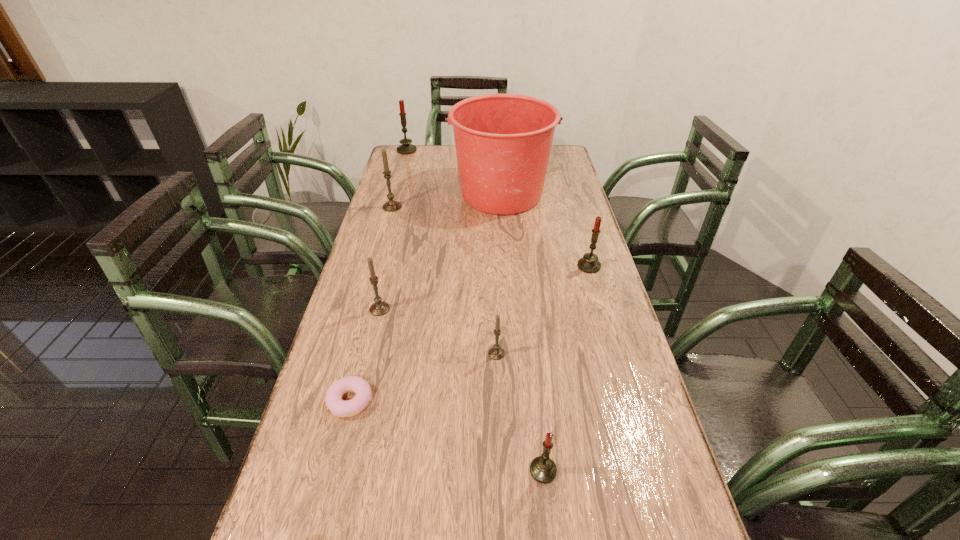
I want to click on object present at the far right corner, so click(x=503, y=142).

Where is `free space at the left edge`? free space at the left edge is located at coordinates (307, 529).

In the image, there is a desktop. In order to click on free space at the right edge in this screenshot , I will do `click(598, 326)`.

At what (x,y) coordinates should I click in order to perform the action: click on free area in between the pink bucket and the third nearest object. Please return your answer as a coordinate pair (x, y). This screenshot has height=540, width=960. Looking at the image, I should click on (499, 274).

Find the location of a particular element. The image size is (960, 540). vacant space that's between the second biggest gray candle and the smallest gray candle is located at coordinates (438, 332).

Locate an element on the screen. The width and height of the screenshot is (960, 540). empty space that is in between the second nearest red candle and the second nearest candle is located at coordinates (542, 310).

What are the coordinates of `vacant space that's between the biggest gray candle and the fourth farthest candle` in the screenshot? It's located at (386, 258).

You are a GUI agent. You are given a task and a screenshot of the screen. Output one action in this format:
    pyautogui.click(x=<x>, y=<y>)
    Task: Click on the unoccupied area between the bucket and the farthest red candle
    Image resolution: width=960 pixels, height=540 pixels.
    Given the screenshot: What is the action you would take?
    pyautogui.click(x=454, y=172)

You are a GUI agent. You are given a task and a screenshot of the screen. Output one action in this format:
    pyautogui.click(x=<x>, y=<y>)
    Task: Click on the vacant space that is in between the third nearest candle and the second candle from right to left
    This screenshot has width=960, height=540.
    Given the screenshot: What is the action you would take?
    pyautogui.click(x=462, y=390)

I want to click on vacant space that's between the farthest object and the pink bucket, so click(x=454, y=172).